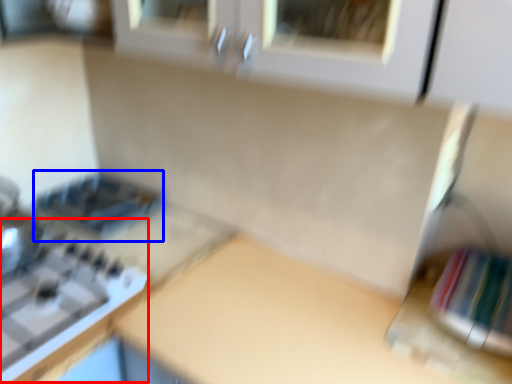
Question: Among these objects, which one is nearest to the camera, gas stove (highlighted by a red box) or appliance (highlighted by a blue box)?

Choices:
 (A) gas stove
 (B) appliance

Answer: (A)